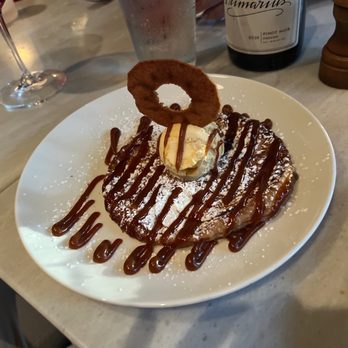
Locate an element on the screen. The width and height of the screenshot is (348, 348). white plate is located at coordinates (84, 283).